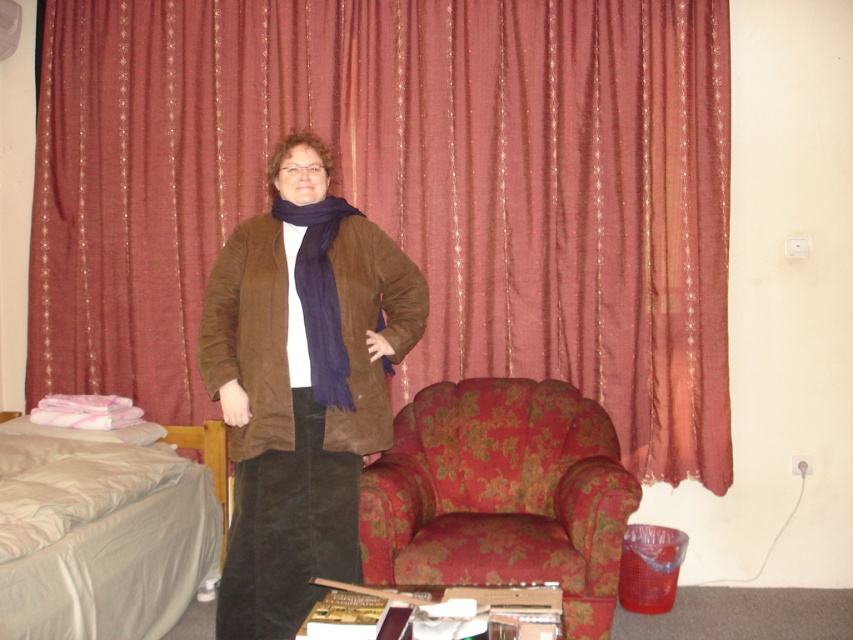
Consider the image. You are a furniture designer evaluating the space in the room. The light gray fabric bed at lower left and the suede brown jacket at center are both in your view. Which object occupies more horizontal space in the room?

The light gray fabric bed at lower left occupies more horizontal space in the room because its width is larger than that of the suede brown jacket at center.

You are a photographer setting up a shoot in this room. You need to place a 1.2 meter tall tripod between the light gray fabric bed at lower left and the suede brown jacket at center. Can the tripod fit vertically between them without touching either object?

The light gray fabric bed at lower left is shorter than the suede brown jacket at center. Since the bed is shorter, the tripod could potentially be placed between them vertically, but the exact height clearance depends on the bed and jacket dimensions. However, the description only states the bed is shorter than the jacket, so we cannot confirm if there is enough vertical space for the 1.2 meter tripod.

You are a photographer adjusting your camera settings. You notice two points in the scene at coordinates point [596,548] and point [183,538]. Which point is nearer to you?

Point [596,548] is closer to the viewer than point [183,538].